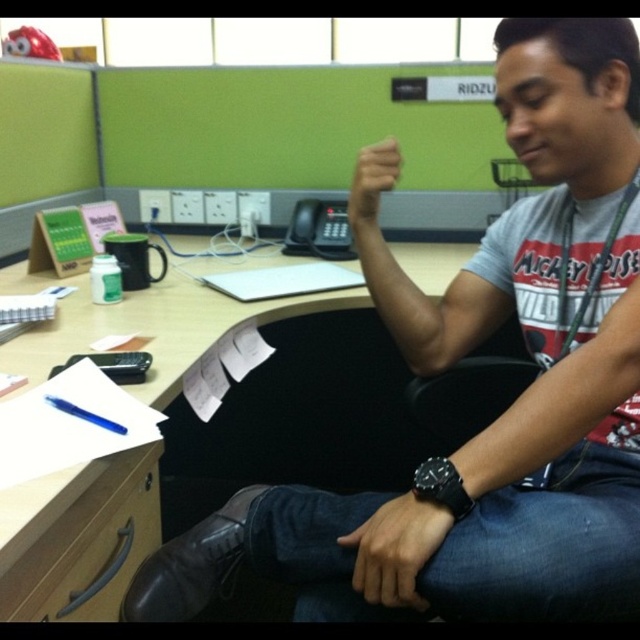
Question: Which point is closer to the camera?

Choices:
 (A) matte skin hand at center
 (B) black leather watch at lower center

Answer: (B)

Question: Is matte skin hand at center smaller than blue plastic pen at lower left?

Choices:
 (A) no
 (B) yes

Answer: (A)

Question: Can you confirm if wooden at lower left is positioned to the right of matte skin hand at center?

Choices:
 (A) yes
 (B) no

Answer: (B)

Question: Is wooden desk at center positioned behind blue plastic pen at lower left?

Choices:
 (A) yes
 (B) no

Answer: (B)

Question: Among these objects, which one is farthest from the camera?

Choices:
 (A) wooden at lower left
 (B) wooden desk at center
 (C) matte skin hand at center

Answer: (C)

Question: Which object appears closest to the camera in this image?

Choices:
 (A) wooden desk at center
 (B) matte skin hand at center

Answer: (A)